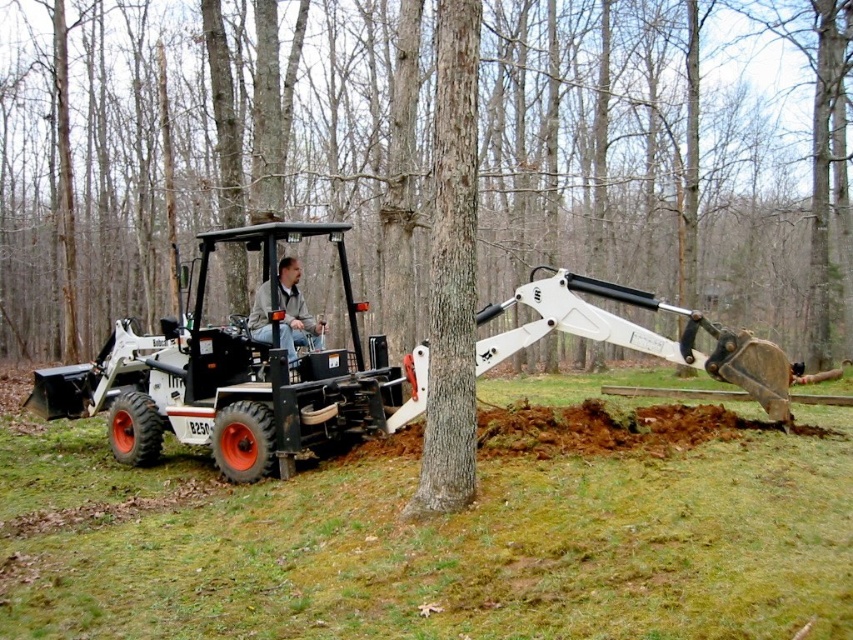
Question: Which object appears closest to the camera in this image?

Choices:
 (A) brown rough bark tree trunk at center
 (B) black rubber tractor at center

Answer: (A)

Question: Can you confirm if black rubber tractor at center is thinner than brown rough bark tree trunk at center?

Choices:
 (A) no
 (B) yes

Answer: (B)

Question: Estimate the real-world distances between objects in this image. Which object is closer to the smooth bark tree at center?

Choices:
 (A) black rubber tractor at center
 (B) leather jacket at center

Answer: (B)

Question: Which object is the closest to the smooth bark tree at center?

Choices:
 (A) brown rough bark tree trunk at center
 (B) black rubber tractor at center

Answer: (A)

Question: Does smooth bark tree at center have a larger size compared to leather jacket at center?

Choices:
 (A) no
 (B) yes

Answer: (B)

Question: From the image, what is the correct spatial relationship of black rubber tractor at center in relation to brown rough bark tree trunk at center?

Choices:
 (A) above
 (B) below

Answer: (B)